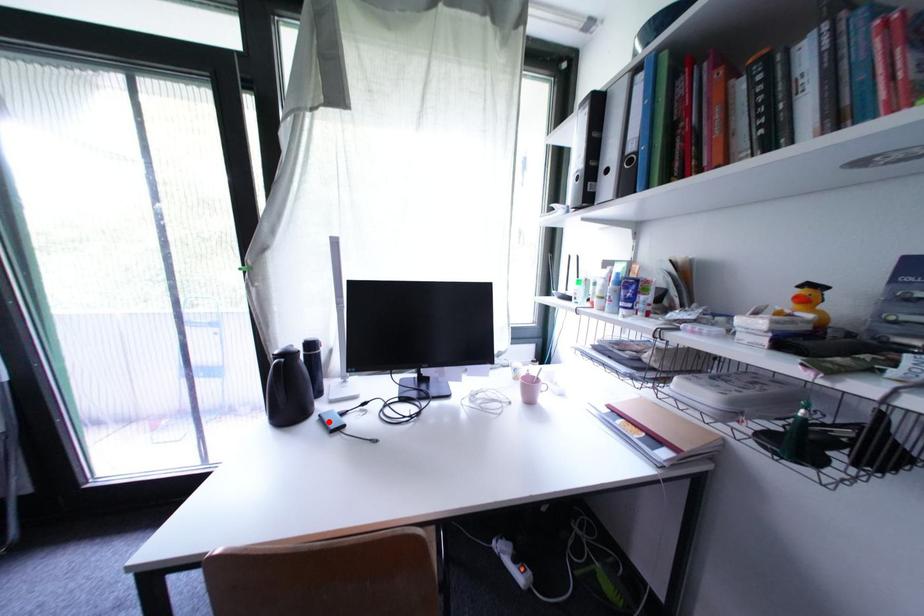
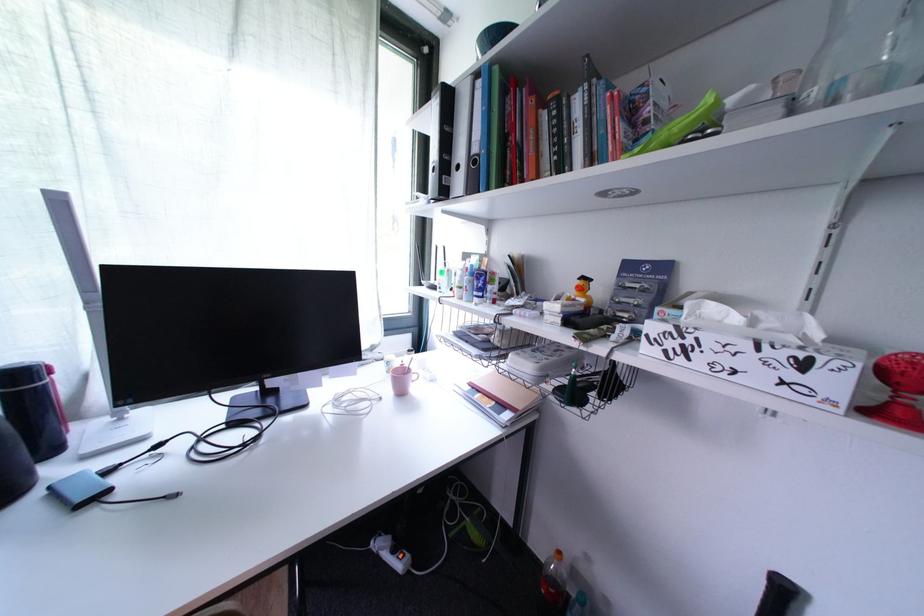
Where in the second image is the point corresponding to the highlighted location from the first image?

(63, 496)